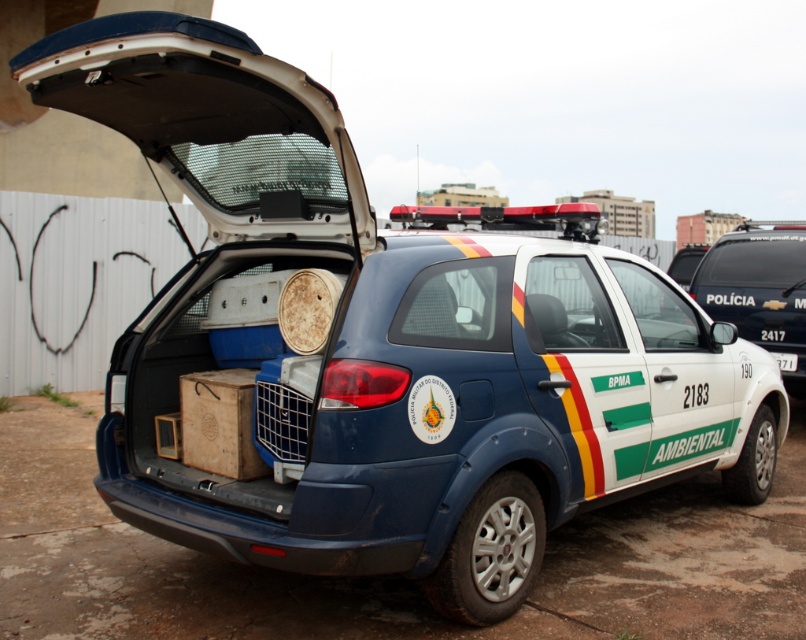
Can you confirm if brown cardboard box at rear is positioned below white plastic license plate at center?

Correct, brown cardboard box at rear is located below white plastic license plate at center.

Is the position of brown cardboard box at rear less distant than that of white plastic license plate at center?

Yes, it is.

Is point (185, 428) farther from viewer compared to point (788, 365)?

That is False.

This screenshot has height=640, width=806. In order to click on brown cardboard box at rear in this screenshot , I will do `click(219, 422)`.

Is white glossy minivan at center to the right of brown cardboard box at rear from the viewer's perspective?

Correct, you'll find white glossy minivan at center to the right of brown cardboard box at rear.

At what (x,y) coordinates should I click in order to perform the action: click on white glossy minivan at center. Please return your answer as a coordinate pair (x, y). This screenshot has width=806, height=640. Looking at the image, I should click on (759, 289).

Describe the element at coordinates (759, 289) in the screenshot. The height and width of the screenshot is (640, 806). I see `white glossy minivan at center` at that location.

At what (x,y) coordinates should I click in order to perform the action: click on white glossy minivan at center. Please return your answer as a coordinate pair (x, y). Image resolution: width=806 pixels, height=640 pixels. Looking at the image, I should click on (759, 289).

Who is positioned more to the right, white glossy minivan at center or white plastic license plate at center?

white plastic license plate at center

Which is behind, point (788, 326) or point (788, 362)?

The point (788, 326) is more distant.

Between point (746, 262) and point (783, 365), which one is positioned in front?

Point (783, 365) is more forward.

Locate an element on the screen. white glossy minivan at center is located at coordinates (759, 289).